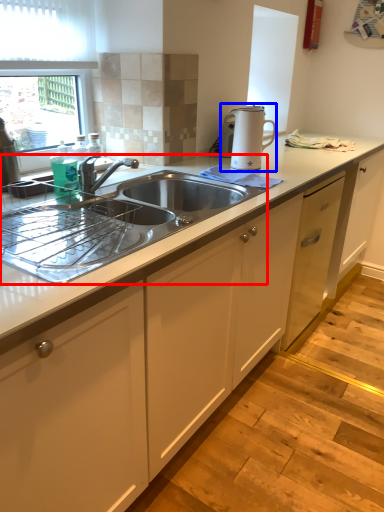
Question: Which object is further to the camera taking this photo, sink (highlighted by a red box) or home appliance (highlighted by a blue box)?

Choices:
 (A) sink
 (B) home appliance

Answer: (B)